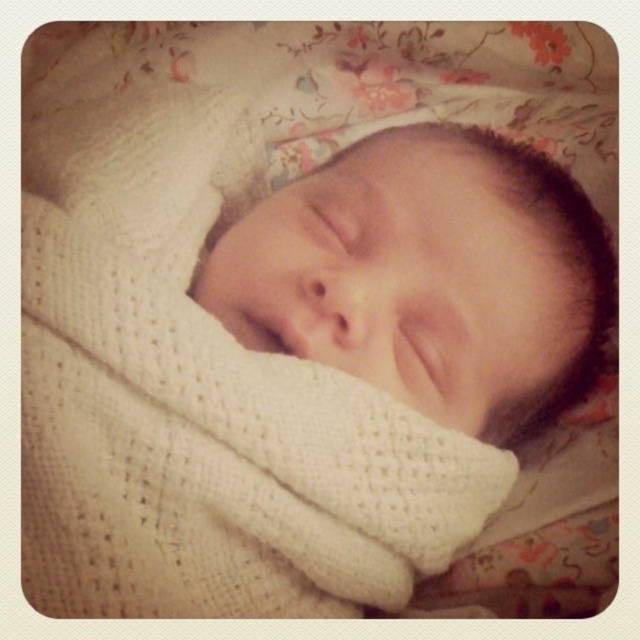
Question: Is white knitted blanket at center wider than white knitted newborn at center?

Choices:
 (A) no
 (B) yes

Answer: (B)

Question: Considering the relative positions of white knitted blanket at center and white knitted newborn at center in the image provided, where is white knitted blanket at center located with respect to white knitted newborn at center?

Choices:
 (A) below
 (B) above

Answer: (A)

Question: From the image, what is the correct spatial relationship of white knitted blanket at center in relation to white knitted newborn at center?

Choices:
 (A) right
 (B) left

Answer: (B)